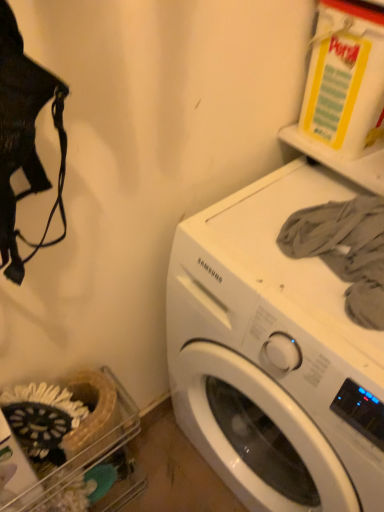
Locate an element on the screen. This screenshot has height=512, width=384. gray cotton shirt at upper right is located at coordinates (345, 250).

This screenshot has height=512, width=384. Describe the element at coordinates (345, 250) in the screenshot. I see `gray cotton shirt at upper right` at that location.

Measure the distance between white glossy washing machine at center and camera.

The depth of white glossy washing machine at center is 58.27 centimeters.

The height and width of the screenshot is (512, 384). What do you see at coordinates (274, 355) in the screenshot?
I see `white glossy washing machine at center` at bounding box center [274, 355].

What is the approximate width of white glossy washing machine at center?

22.71 inches.

This screenshot has width=384, height=512. I want to click on white glossy washing machine at center, so click(274, 355).

Locate an element on the screen. This screenshot has width=384, height=512. gray cotton shirt at upper right is located at coordinates (345, 250).

Is gray cotton shirt at upper right to the right of white glossy washing machine at center from the viewer's perspective?

Incorrect, gray cotton shirt at upper right is not on the right side of white glossy washing machine at center.

Between gray cotton shirt at upper right and white glossy washing machine at center, which one is positioned in front?

white glossy washing machine at center is more forward.

Which is closer, (333, 234) or (260, 417)?

The point (333, 234) is closer to the camera.

From the image's perspective, relative to white glossy washing machine at center, is gray cotton shirt at upper right above or below?

Clearly, from the image's perspective, gray cotton shirt at upper right is above white glossy washing machine at center.

From a real-world perspective, is gray cotton shirt at upper right physically located above or below white glossy washing machine at center?

In terms of real-world spatial position, gray cotton shirt at upper right is above white glossy washing machine at center.

Considering the sizes of objects gray cotton shirt at upper right and white glossy washing machine at center in the image provided, who is wider, gray cotton shirt at upper right or white glossy washing machine at center?

white glossy washing machine at center.

Can you confirm if gray cotton shirt at upper right is taller than white glossy washing machine at center?

No.

Who is smaller, gray cotton shirt at upper right or white glossy washing machine at center?

Smaller between the two is gray cotton shirt at upper right.

Is white glossy washing machine at center completely or partially inside gray cotton shirt at upper right?

No, gray cotton shirt at upper right does not contain white glossy washing machine at center.

Would you say gray cotton shirt at upper right is a long distance from white glossy washing machine at center?

No, gray cotton shirt at upper right is in close proximity to white glossy washing machine at center.

Is gray cotton shirt at upper right looking in the opposite direction of white glossy washing machine at center?

gray cotton shirt at upper right does not have its back to white glossy washing machine at center.

Can you tell me how much gray cotton shirt at upper right and white glossy washing machine at center differ in facing direction?

1.77 degrees separate the facing orientations of gray cotton shirt at upper right and white glossy washing machine at center.

How much distance is there between gray cotton shirt at upper right and white glossy washing machine at center?

7.64 inches.

At what (x,y) coordinates should I click in order to perform the action: click on washing machine directly beneath the gray cotton shirt at upper right (from a real-world perspective). Please return your answer as a coordinate pair (x, y). The image size is (384, 512). Looking at the image, I should click on click(x=274, y=355).

Is white glossy washing machine at center at the right side of gray cotton shirt at upper right?

Correct, you'll find white glossy washing machine at center to the right of gray cotton shirt at upper right.

Considering the positions of objects white glossy washing machine at center and gray cotton shirt at upper right in the image provided, who is in front, white glossy washing machine at center or gray cotton shirt at upper right?

white glossy washing machine at center is closer to the camera.

Does point (218, 287) come closer to viewer compared to point (347, 213)?

No, it is not.

Consider the image. From the image's perspective, is white glossy washing machine at center on top of gray cotton shirt at upper right?

No, from the image's perspective, white glossy washing machine at center is not over gray cotton shirt at upper right.

From a real-world perspective, is white glossy washing machine at center on top of gray cotton shirt at upper right?

Actually, white glossy washing machine at center is physically below gray cotton shirt at upper right in the real world.

In terms of width, does white glossy washing machine at center look wider or thinner when compared to gray cotton shirt at upper right?

white glossy washing machine at center is wider than gray cotton shirt at upper right.

Considering the sizes of objects white glossy washing machine at center and gray cotton shirt at upper right in the image provided, who is shorter, white glossy washing machine at center or gray cotton shirt at upper right?

With less height is gray cotton shirt at upper right.

Looking at this image, does white glossy washing machine at center have a larger size compared to gray cotton shirt at upper right?

Correct, white glossy washing machine at center is larger in size than gray cotton shirt at upper right.

Is white glossy washing machine at center not inside gray cotton shirt at upper right?

white glossy washing machine at center is positioned outside gray cotton shirt at upper right.

Is white glossy washing machine at center not close to gray cotton shirt at upper right?

white glossy washing machine at center is actually quite close to gray cotton shirt at upper right.

Is white glossy washing machine at center aimed at gray cotton shirt at upper right?

No, white glossy washing machine at center is not aimed at gray cotton shirt at upper right.

Can you tell me how much white glossy washing machine at center and gray cotton shirt at upper right differ in facing direction?

The angle between the facing direction of white glossy washing machine at center and the facing direction of gray cotton shirt at upper right is 1.77 degrees.

Identify the location of washing machine below the gray cotton shirt at upper right (from the image's perspective). (274, 355).

This screenshot has height=512, width=384. Find the location of `washing machine in front of the gray cotton shirt at upper right`. washing machine in front of the gray cotton shirt at upper right is located at coordinates (274, 355).

You are a GUI agent. You are given a task and a screenshot of the screen. Output one action in this format:
    pyautogui.click(x=<x>, y=<y>)
    Task: Click on the washing machine on the right of gray cotton shirt at upper right
    The width and height of the screenshot is (384, 512).
    Given the screenshot: What is the action you would take?
    pyautogui.click(x=274, y=355)